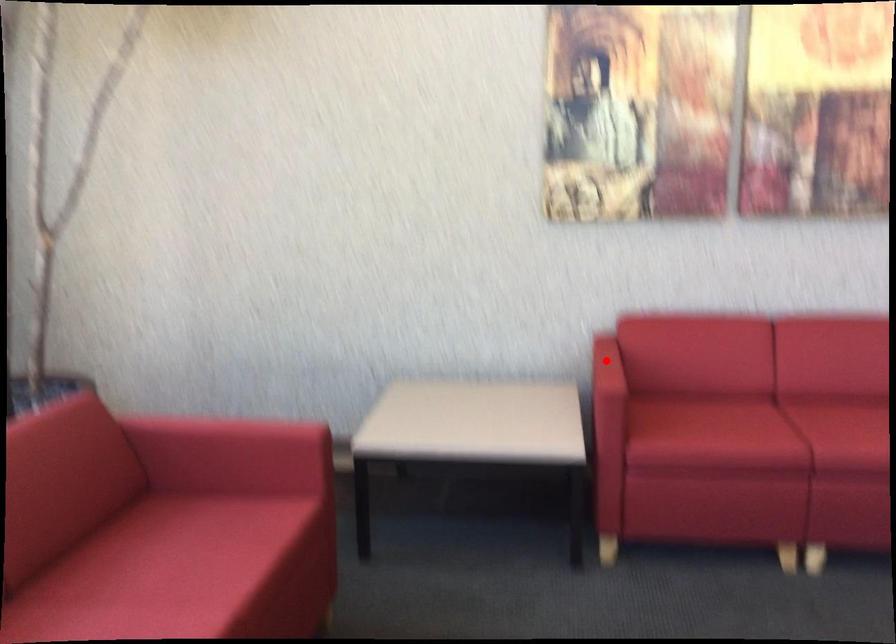
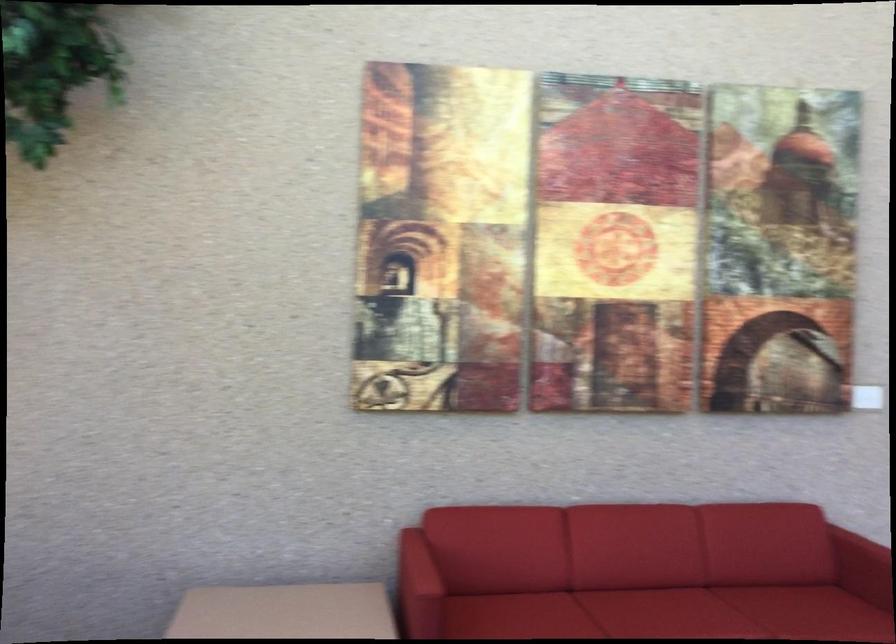
In the second image, find the point that corresponds to the highlighted location in the first image.

(418, 564)